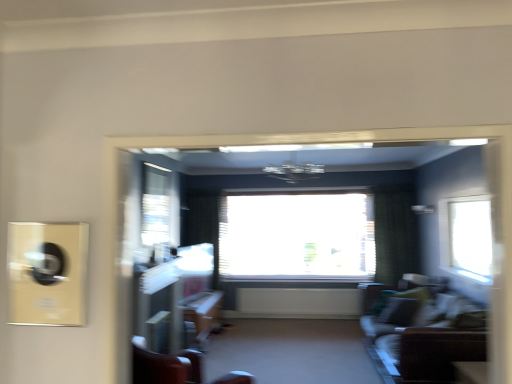
Describe the element at coordinates (165, 365) in the screenshot. The image size is (512, 384). I see `wooden chair at center` at that location.

How much space does transparent glass window at right, arranged as the third window when viewed from the back, occupy vertically?

34.91 inches.

Where is `green fabric curtain at center`? green fabric curtain at center is located at coordinates (395, 232).

What do you see at coordinates (156, 204) in the screenshot?
I see `transparent glass window at upper center, acting as the first window starting from the left` at bounding box center [156, 204].

I want to click on wooden chair at center, so click(x=165, y=365).

The height and width of the screenshot is (384, 512). In order to click on the 2nd table below the velvet green sofa at lower right (from a real-world perspective) in this screenshot , I will do `click(201, 318)`.

From the image's perspective, between wooden table at center, the first table when ordered from left to right, and velvet green sofa at lower right, who is located below?

wooden table at center, the first table when ordered from left to right.

Is wooden table at center, marked as the second table in a right-to-left arrangement, taller or shorter than velvet green sofa at lower right?

wooden table at center, marked as the second table in a right-to-left arrangement, is shorter than velvet green sofa at lower right.

Relative to velvet green sofa at lower right, is wooden table at center, which ranks as the 1th table in back-to-front order, in front or behind?

wooden table at center, which ranks as the 1th table in back-to-front order, is positioned farther from the viewer than velvet green sofa at lower right.

Is matte brown table at lower right, which is counted as the second table, starting from the left, facing away from transparent glass window at upper center, the second window when ordered from front to back?

No, matte brown table at lower right, which is counted as the second table, starting from the left,'s orientation is not away from transparent glass window at upper center, the second window when ordered from front to back.

Is matte brown table at lower right, the first table positioned from the front, in front of transparent glass window at upper center, the second window when ordered from front to back?

Yes, matte brown table at lower right, the first table positioned from the front, is closer to the camera.

Considering the sizes of matte brown table at lower right, acting as the second table starting from the bottom, and transparent glass window at upper center, acting as the first window starting from the left, in the image, is matte brown table at lower right, acting as the second table starting from the bottom, wider or thinner than transparent glass window at upper center, acting as the first window starting from the left,?

Clearly, matte brown table at lower right, acting as the second table starting from the bottom, has more width compared to transparent glass window at upper center, acting as the first window starting from the left.

In terms of size, does matte brown table at lower right, which is counted as the second table, starting from the left, appear bigger or smaller than transparent glass window at upper center, acting as the first window starting from the left?

In the image, matte brown table at lower right, which is counted as the second table, starting from the left, appears to be smaller than transparent glass window at upper center, acting as the first window starting from the left.

Is wooden chair at center touching velvet green sofa at lower right?

wooden chair at center and velvet green sofa at lower right are not in contact.

Considering the points (151, 376) and (410, 309), which point is in front, point (151, 376) or point (410, 309)?

The point (151, 376) is closer to the camera.

From the picture: Between wooden chair at center and velvet green sofa at lower right, which one has less height?

wooden chair at center.

Does wooden chair at center appear on the left side of velvet green sofa at lower right?

Yes.

From a real-world perspective, which is physically below, transparent glass window at upper center, acting as the first window starting from the left, or matte gray carpet at center?

matte gray carpet at center, from a real-world perspective.

Is transparent glass window at upper center, acting as the first window starting from the left, oriented towards matte gray carpet at center?

No, transparent glass window at upper center, acting as the first window starting from the left, is not turned towards matte gray carpet at center.

Considering the sizes of transparent glass window at upper center, acting as the first window starting from the left, and matte gray carpet at center in the image, is transparent glass window at upper center, acting as the first window starting from the left, bigger or smaller than matte gray carpet at center?

Clearly, transparent glass window at upper center, acting as the first window starting from the left, is smaller in size than matte gray carpet at center.

In the image, is transparent glass window at upper center, the third window when ordered from right to left, on the left side or the right side of matte gray carpet at center?

From the image, it's evident that transparent glass window at upper center, the third window when ordered from right to left, is to the left of matte gray carpet at center.

Which of these two, matte gray carpet at center or transparent glass window at right, positioned as the third window in left-to-right order, is wider?

matte gray carpet at center.

From the picture: Do you think matte gray carpet at center is within transparent glass window at right, arranged as the third window when viewed from the back, or outside of it?

matte gray carpet at center is not enclosed by transparent glass window at right, arranged as the third window when viewed from the back.

Can you tell me how much matte gray carpet at center and transparent glass window at right, arranged as the third window when viewed from the back, differ in facing direction?

matte gray carpet at center and transparent glass window at right, arranged as the third window when viewed from the back, are facing 179 degrees away from each other.

Considering the sizes of objects matte gray carpet at center and transparent glass window at right, acting as the 1th window starting from the right, in the image provided, who is smaller, matte gray carpet at center or transparent glass window at right, acting as the 1th window starting from the right,?

With smaller size is transparent glass window at right, acting as the 1th window starting from the right.

Between point (300, 227) and point (212, 314), which one is positioned behind?

The point (300, 227) is farther from the camera.

From the image's perspective, is transparent glass window at center, acting as the 3th window starting from the front, located beneath wooden table at center, which ranks as the 1th table in back-to-front order?

Actually, transparent glass window at center, acting as the 3th window starting from the front, appears above wooden table at center, which ranks as the 1th table in back-to-front order, in the image.

Is transparent glass window at center, acting as the 3th window starting from the front, inside or outside of wooden table at center, arranged as the first table when ordered from the bottom?

transparent glass window at center, acting as the 3th window starting from the front, is located beyond the bounds of wooden table at center, arranged as the first table when ordered from the bottom.

Does transparent glass window at center, acting as the 3th window starting from the front, have a greater height compared to wooden table at center, arranged as the first table when ordered from the bottom?

Indeed, transparent glass window at center, acting as the 3th window starting from the front, has a greater height compared to wooden table at center, arranged as the first table when ordered from the bottom.

What's the angular difference between transparent glass window at center, acting as the 3th window starting from the front, and transparent glass window at upper center, which appears as the 2th window when viewed from the back,'s facing directions?

The facing directions of transparent glass window at center, acting as the 3th window starting from the front, and transparent glass window at upper center, which appears as the 2th window when viewed from the back, are 90.7 degrees apart.

Is transparent glass window at upper center, which appears as the 2th window when viewed from the back, inside transparent glass window at center, the 1th window positioned from the back?

No.

Between point (271, 216) and point (143, 170), which one is positioned in front?

The point (143, 170) is closer to the camera.

How distant is transparent glass window at center, arranged as the 2th window when viewed from the left, from transparent glass window at upper center, the second window when ordered from front to back?

They are 1.69 meters apart.

At what (x,y) coordinates should I click in order to perform the action: click on the 2nd table located beneath the velvet green sofa at lower right (from a real-world perspective). Please return your answer as a coordinate pair (x, y). This screenshot has width=512, height=384. Looking at the image, I should click on (201, 318).

The height and width of the screenshot is (384, 512). Identify the location of table in front of the transparent glass window at upper center, the second window when ordered from front to back. [x=471, y=372].

From the image, which object appears to be farther from wooden chair at center, velvet green sofa at lower right or transparent glass window at right, marked as the first window in a front-to-back arrangement?

transparent glass window at right, marked as the first window in a front-to-back arrangement, is further to wooden chair at center.

From the image, which object appears to be nearer to wooden chair at center, matte gray carpet at center or transparent glass window at right, arranged as the third window when viewed from the back?

matte gray carpet at center is positioned closer to the anchor wooden chair at center.

Based on the photo, which object lies nearer to the anchor point matte brown table at lower right, acting as the second table starting from the bottom, transparent glass window at right, marked as the first window in a front-to-back arrangement, or transparent glass window at upper center, the third window when ordered from right to left?

transparent glass window at right, marked as the first window in a front-to-back arrangement, is positioned closer to the anchor matte brown table at lower right, acting as the second table starting from the bottom.

Considering their positions, is wooden table at center, which is counted as the second table, starting from the top, positioned closer to green fabric curtain at center than matte gray carpet at center?

wooden table at center, which is counted as the second table, starting from the top, is positioned closer to the anchor green fabric curtain at center.

Which object lies nearer to the anchor point transparent glass window at upper center, the second window when ordered from front to back, green fabric curtain at center or transparent glass window at right, arranged as the third window when viewed from the back?

green fabric curtain at center is positioned closer to the anchor transparent glass window at upper center, the second window when ordered from front to back.

When comparing their distances from transparent glass window at right, arranged as the third window when viewed from the back, does matte brown table at lower right, the second table in the back-to-front sequence, or wooden table at center, which is counted as the second table, starting from the top, seem closer?

matte brown table at lower right, the second table in the back-to-front sequence, lies closer to transparent glass window at right, arranged as the third window when viewed from the back, than the other object.

When comparing their distances from matte gray carpet at center, does velvet green sofa at lower right or green fabric curtain at center seem closer?

velvet green sofa at lower right is positioned closer to the anchor matte gray carpet at center.

Consider the image. When comparing their distances from velvet green sofa at lower right, does transparent glass window at center, arranged as the 2th window when viewed from the left, or matte gray carpet at center seem closer?

Among the two, transparent glass window at center, arranged as the 2th window when viewed from the left, is located nearer to velvet green sofa at lower right.

The image size is (512, 384). In order to click on studio couch between transparent glass window at right, marked as the first window in a front-to-back arrangement, and matte brown table at lower right, the first table in the top-to-bottom sequence, in the up-down direction in this screenshot , I will do `click(423, 341)`.

Find the location of a particular element. The height and width of the screenshot is (384, 512). hotel lobby located between transparent glass window at upper center, acting as the first window starting from the left, and transparent glass window at right, marked as the first window in a front-to-back arrangement, in the left-right direction is located at coordinates (386, 140).

Image resolution: width=512 pixels, height=384 pixels. What are the coordinates of `curtain between matte gray carpet at center and transparent glass window at center, the 1th window positioned from the back, in the front-back direction` in the screenshot? It's located at (395, 232).

The image size is (512, 384). I want to click on studio couch located between wooden chair at center and green fabric curtain at center in the depth direction, so click(x=423, y=341).